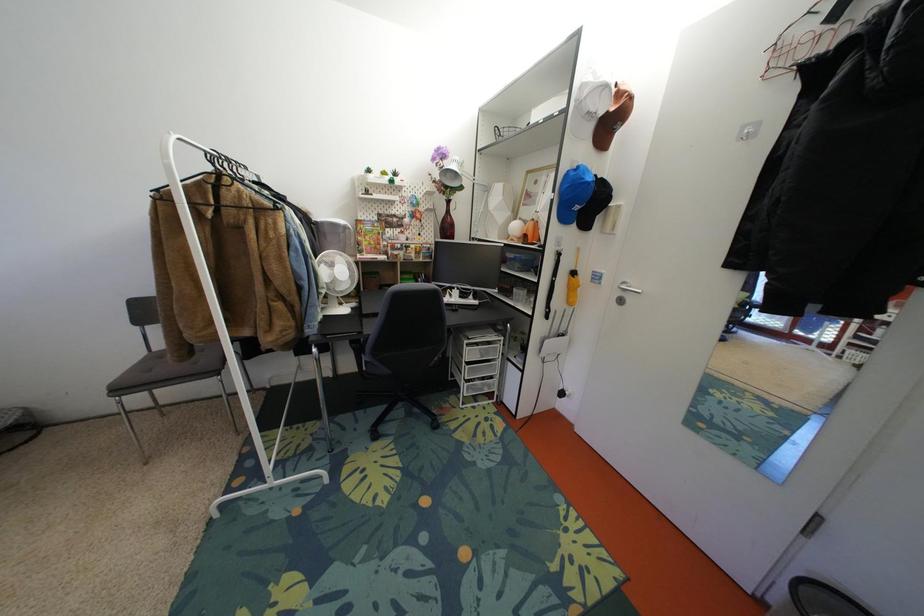
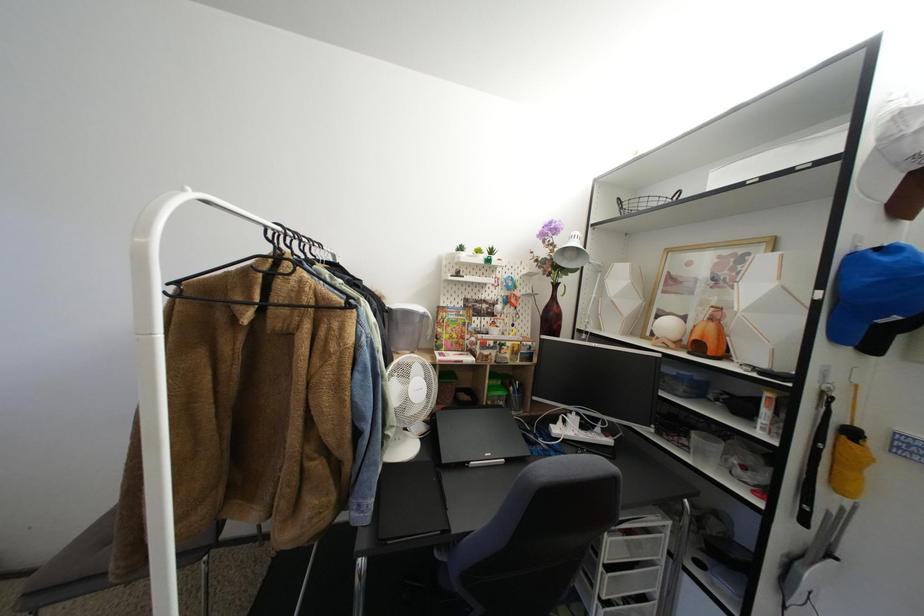
The images are taken continuously from a first-person perspective. In which direction are you moving?

The cameraman walked toward left, forward.